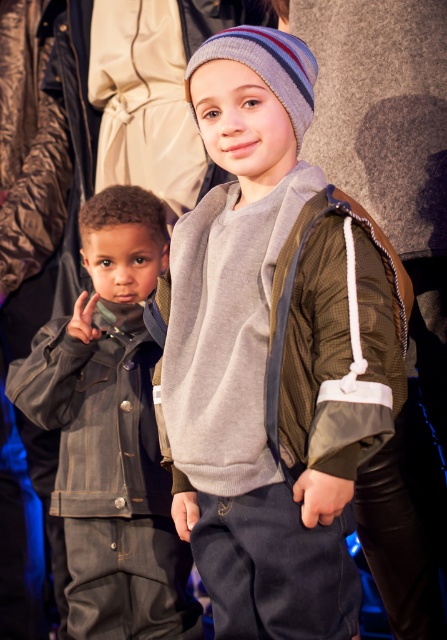
You are a fashion designer observing two items in the image. You need to decide which item is taller between the gray fleece sweatshirt at center and the striped knit beanie at upper center. Which one is taller?

The gray fleece sweatshirt at center is taller than the striped knit beanie at upper center according to the description.

You are a photographer setting up a shoot at the fashion display. You need to place a prop exactly at the coordinates given for the gray fleece sweatshirt at center. What are the coordinates where you should place the prop?

The gray fleece sweatshirt at center is located at point (275, 339), so you should place the prop at those coordinates.

You are a photographer trying to capture the denim jacket at left in a closeup shot. The camera you are using has a focus point at coordinate (112, 433). Will this focus point align with the denim jacket at left?

Yes, the focus point at coordinate (112, 433) aligns with the denim jacket at left because the point corresponds to it according to the description.